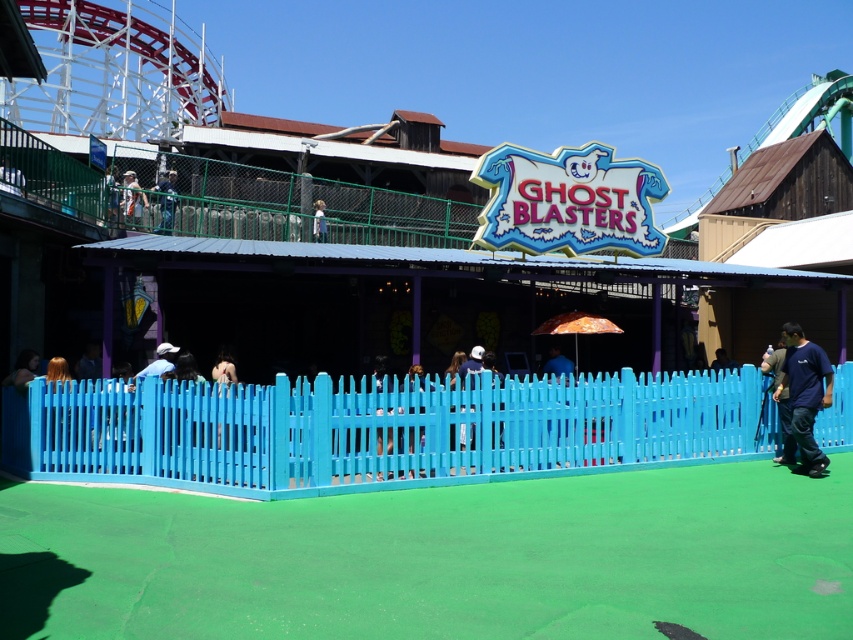
Who is more distant from viewer, [123,220] or [321,220]?

Positioned behind is point [321,220].

At what (x,y) coordinates should I click in order to perform the action: click on tan fabric shirt at upper left. Please return your answer as a coordinate pair (x, y). Looking at the image, I should click on (132, 198).

Is blue fabric shirt at upper center positioned before white fabric at upper center?

No, it is behind white fabric at upper center.

Describe the element at coordinates (166, 202) in the screenshot. I see `blue fabric shirt at upper center` at that location.

Does point (164, 227) come in front of point (323, 224)?

Yes, point (164, 227) is in front of point (323, 224).

At what (x,y) coordinates should I click in order to perform the action: click on blue fabric shirt at upper center. Please return your answer as a coordinate pair (x, y). Looking at the image, I should click on (166, 202).

Between bright blue painted wood fence at center and white fabric at upper center, which one has more height?

white fabric at upper center is taller.

Is bright blue painted wood fence at center bigger than white fabric at upper center?

Actually, bright blue painted wood fence at center might be smaller than white fabric at upper center.

Who is more distant from viewer, (x=225, y=401) or (x=318, y=218)?

The point (x=318, y=218) is behind.

Locate an element on the screen. bright blue painted wood fence at center is located at coordinates (376, 429).